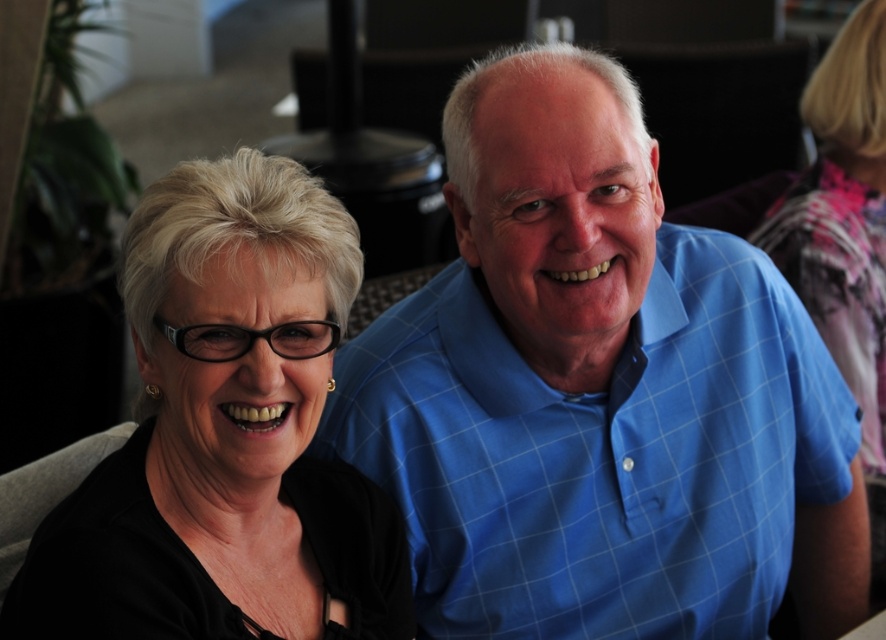
You are designing a layout for a magazine cover and need to place the blue checkered shirt at center and the black matte glasses at left. Given their heights, which object should be placed higher on the page to maintain visual balance?

The blue checkered shirt at center has a lesser height compared to black matte glasses at left, so to maintain visual balance, the black matte glasses at left should be placed higher on the page since it is taller and needs to be elevated to balance the shorter shirt.

You are designing a layout for a magazine cover and need to place two elements. The first is the blue checkered shirt at center, and the second is the black matte glasses at left. If you want to maintain the same spatial relationship as in the original image, which element should you make larger?

The blue checkered shirt at center should be made larger because it has a larger size compared to the black matte glasses at left in the original image.

What is the 2D coordinate of the blue checkered shirt at center?

The 2D coordinate of the blue checkered shirt at center is at point (x=601, y=452).